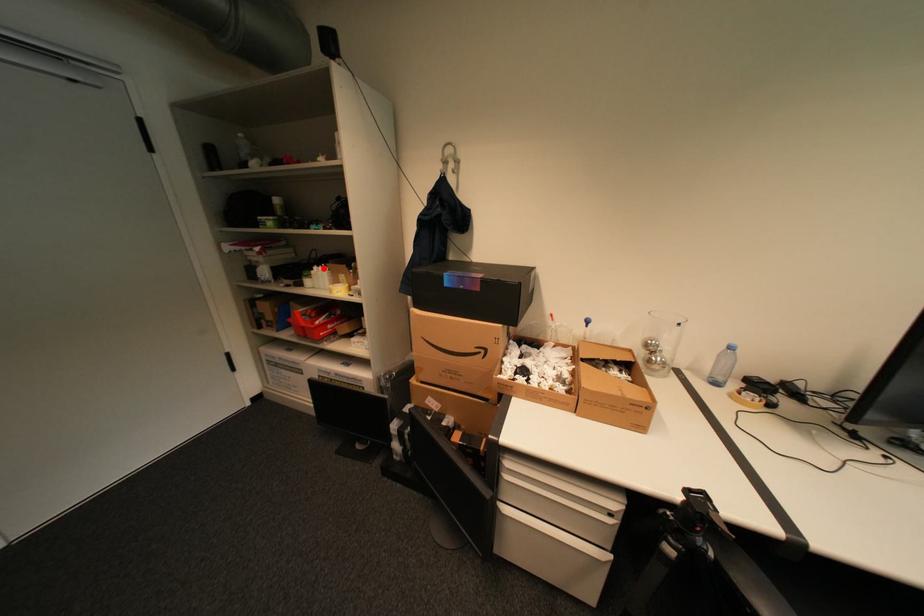
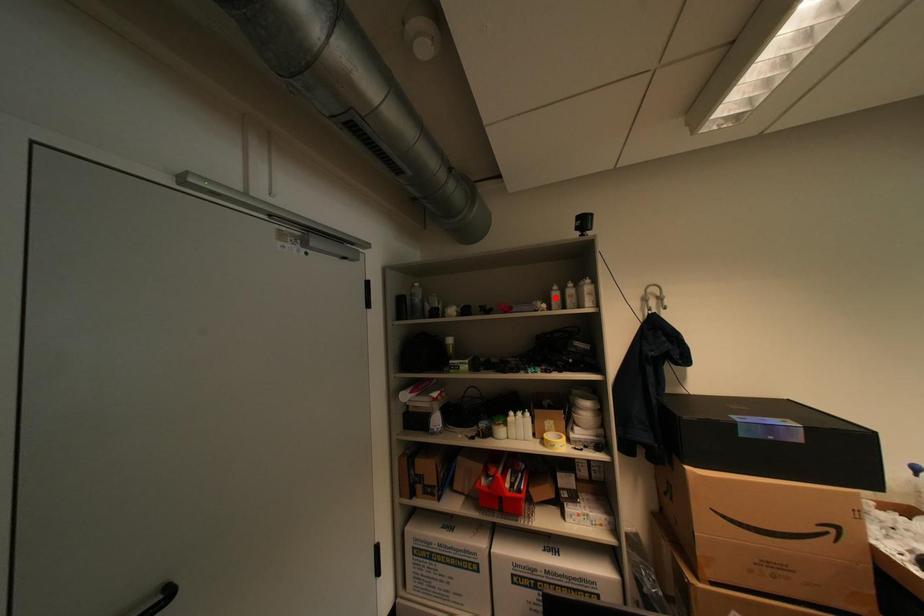
I am providing you with two images of the same scene from different viewpoints. A red point is marked on the first image and another point is marked on the second image. Is the marked point in image1 the same physical position as the marked point in image2?

No